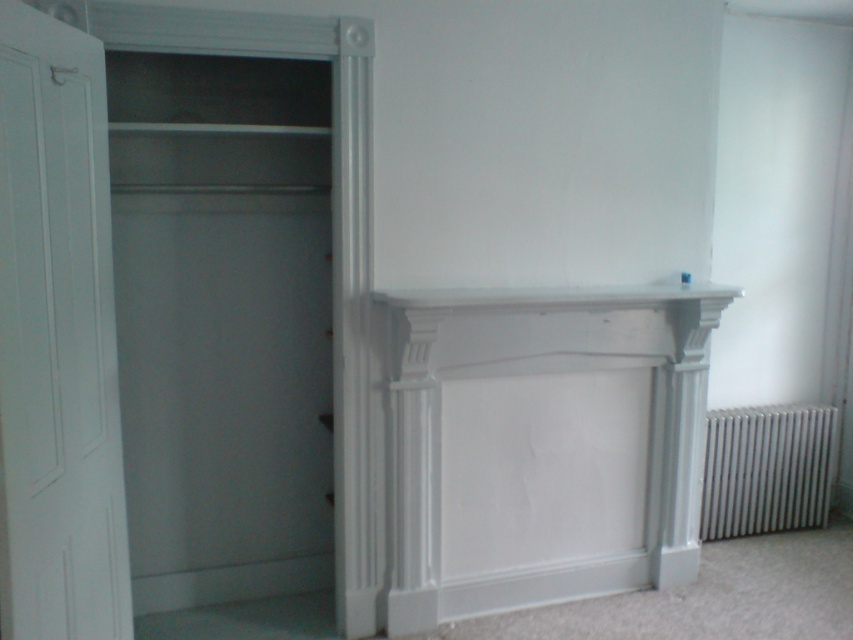
Between point (666, 465) and point (769, 458), which one is positioned behind?

Positioned behind is point (769, 458).

Which is above, white painted wood fireplace at center or white metallic radiator at lower right?

white painted wood fireplace at center is higher up.

What do you see at coordinates (543, 445) in the screenshot? I see `white painted wood fireplace at center` at bounding box center [543, 445].

Identify the location of white painted wood fireplace at center. The height and width of the screenshot is (640, 853). (543, 445).

Who is lower down, white painted wood fireplace at center or white smooth mantle at center?

Positioned lower is white painted wood fireplace at center.

In the scene shown: Is white painted wood fireplace at center further to the viewer compared to white smooth mantle at center?

Yes, it is behind white smooth mantle at center.

Is point (444, 582) positioned in front of point (740, 296)?

Yes, it is.

At what (x,y) coordinates should I click in order to perform the action: click on white painted wood fireplace at center. Please return your answer as a coordinate pair (x, y). This screenshot has height=640, width=853. Looking at the image, I should click on [543, 445].

Does white metallic radiator at lower right have a lesser height compared to white smooth mantle at center?

In fact, white metallic radiator at lower right may be taller than white smooth mantle at center.

Does white metallic radiator at lower right have a smaller size compared to white smooth mantle at center?

No.

Which is in front, point (821, 524) or point (659, 296)?

Point (659, 296)

The image size is (853, 640). Find the location of `white metallic radiator at lower right`. white metallic radiator at lower right is located at coordinates (767, 468).